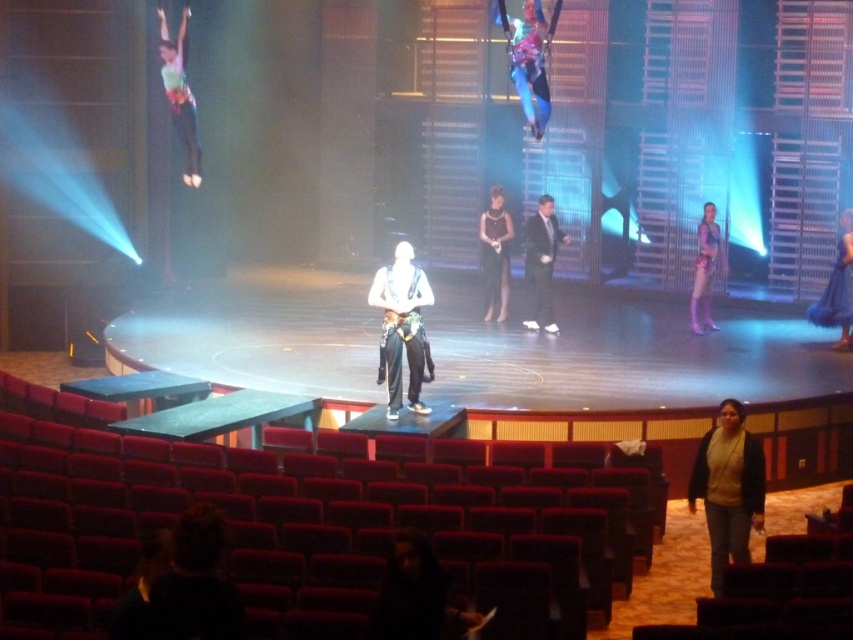
Is the position of white matte pants at center less distant than that of matte green fabric at upper left?

Yes, white matte pants at center is in front of matte green fabric at upper left.

This screenshot has width=853, height=640. What do you see at coordinates (401, 324) in the screenshot?
I see `white matte pants at center` at bounding box center [401, 324].

The height and width of the screenshot is (640, 853). In order to click on white matte pants at center in this screenshot , I will do coord(401,324).

Is jeans at lower right positioned at the back of purple metallic costume at right?

No, it is in front of purple metallic costume at right.

Who is more forward, (706, 496) or (712, 326)?

Positioned in front is point (706, 496).

Where is `jeans at lower right`? The image size is (853, 640). jeans at lower right is located at coordinates (728, 486).

Which is below, jeans at lower right or black satin dress at center?

jeans at lower right is lower down.

Is jeans at lower right shorter than black satin dress at center?

Yes, jeans at lower right is shorter than black satin dress at center.

Is point (701, 476) closer to viewer compared to point (503, 246)?

Yes, it is.

This screenshot has width=853, height=640. I want to click on jeans at lower right, so click(728, 486).